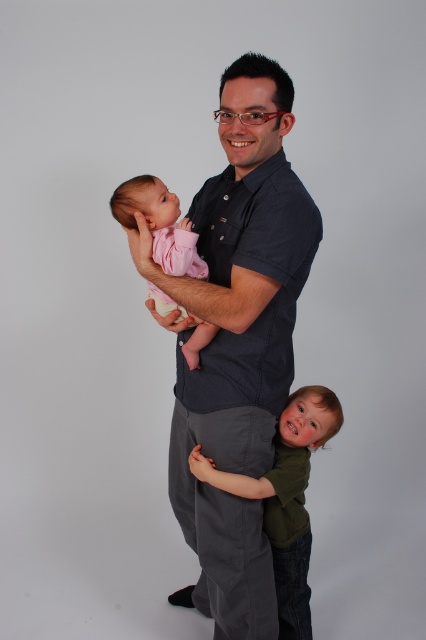
Question: Which point is farther to the camera?

Choices:
 (A) (120, 192)
 (B) (213, 490)
 (C) (285, 483)

Answer: (C)

Question: Which object appears closest to the camera in this image?

Choices:
 (A) dark blue shirt at center
 (B) green matte shirt at lower right
 (C) pink soft fabric baby at left

Answer: (A)

Question: Is dark blue shirt at center below pink soft fabric baby at left?

Choices:
 (A) yes
 (B) no

Answer: (A)

Question: Does green matte shirt at lower right come behind pink soft fabric baby at left?

Choices:
 (A) no
 (B) yes

Answer: (B)

Question: Which object is positioned farthest from the dark blue shirt at center?

Choices:
 (A) green matte shirt at lower right
 (B) pink soft fabric baby at left

Answer: (A)

Question: Can you confirm if dark blue shirt at center is wider than pink soft fabric baby at left?

Choices:
 (A) yes
 (B) no

Answer: (A)